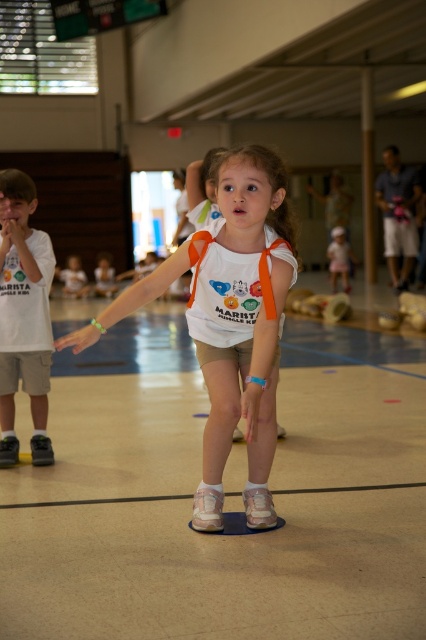
Looking at this image, you are a photographer at the gymnasium and want to capture a photo where both the white matte tank top at center and the pink fabric dress at center are clearly visible. Given their sizes, which one might appear larger in the photo?

The white matte tank top at center is much taller than the pink fabric dress at center, so it will appear larger in the photo.

Based on the scene description, where is the white matte tank top at center located in the image?

The white matte tank top at center is located at point (230,323).